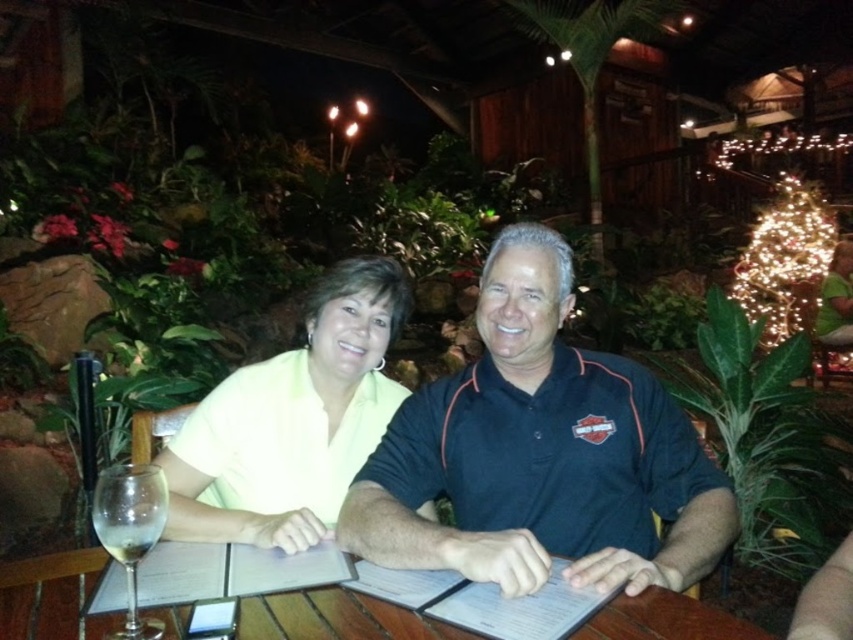
Is wooden table at center positioned in front of clear glass wine glass at lower left?

No, it is behind clear glass wine glass at lower left.

Which is behind, point (692, 616) or point (112, 467)?

The point (112, 467) is more distant.

Identify the location of wooden table at center. (335, 618).

Who is higher up, yellow matte shirt at center or clear glass wine glass at lower left?

Answer: yellow matte shirt at center is higher up.

Which is in front, point (331, 364) or point (114, 516)?

Positioned in front is point (114, 516).

In order to click on yellow matte shirt at center in this screenshot , I will do `click(292, 420)`.

Is point (694, 452) closer to camera compared to point (287, 545)?

No, (694, 452) is behind (287, 545).

From the picture: Is dark blue polo shirt at center wider than yellow matte shirt at center?

Yes, dark blue polo shirt at center is wider than yellow matte shirt at center.

Is point (453, 458) positioned in front of point (225, 529)?

No.

You are a GUI agent. You are given a task and a screenshot of the screen. Output one action in this format:
    pyautogui.click(x=<x>, y=<y>)
    Task: Click on the dark blue polo shirt at center
    
    Given the screenshot: What is the action you would take?
    pyautogui.click(x=541, y=452)